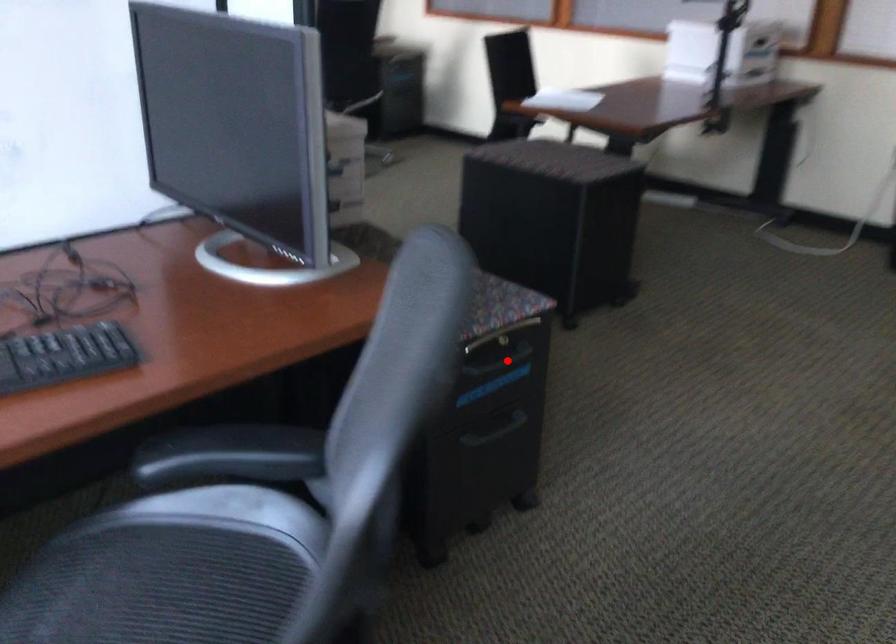
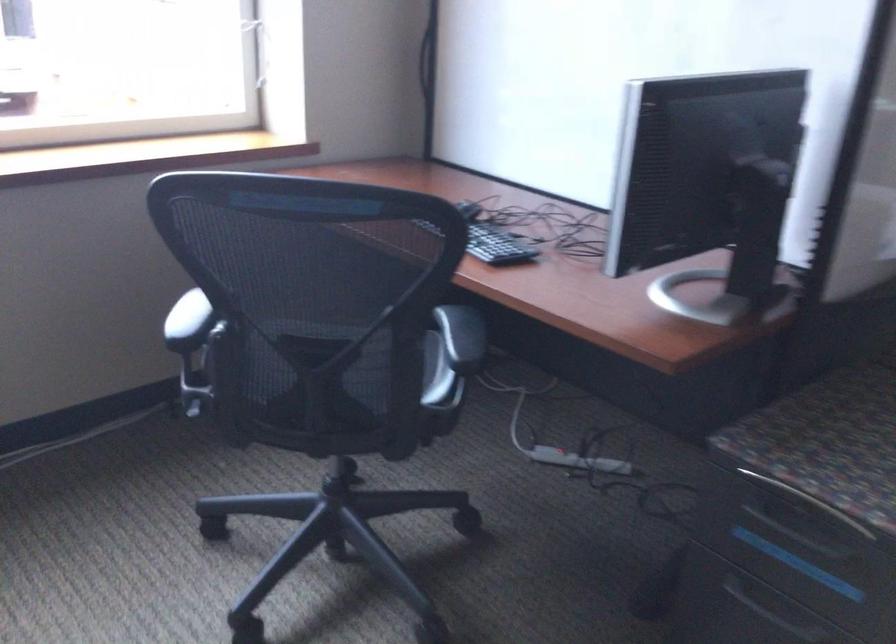
Question: I am providing you with two images of the same scene from different viewpoints. Image1 has a red point marked. In image2, the corresponding 3D location appears at what relative position? Reply with the corresponding letter.

Choices:
 (A) Closer
 (B) Farther

Answer: (A)